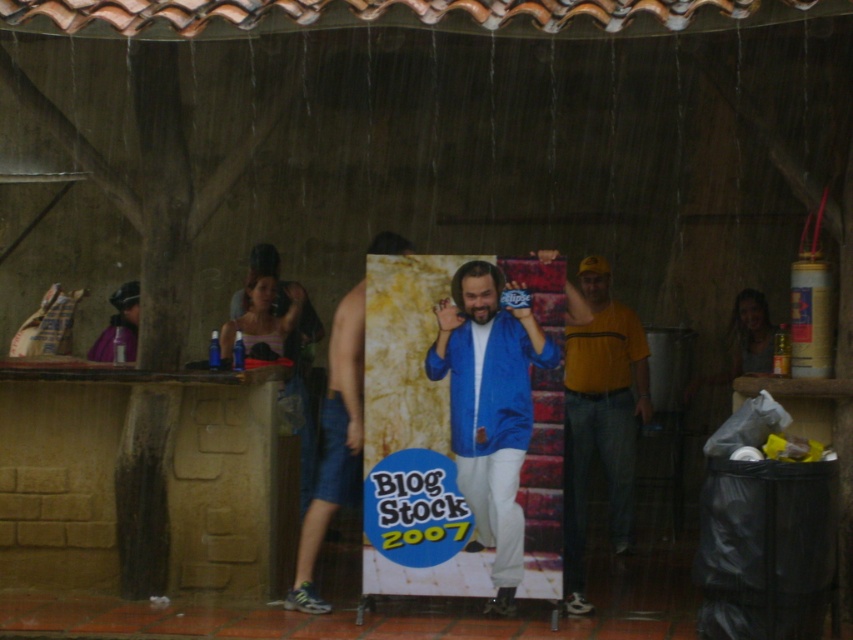
You are standing in the rain under the tiled roof and see the blue shiny jacket at center and denim shorts at center. Which object is taller?

The blue shiny jacket at center is taller than the denim shorts at center.